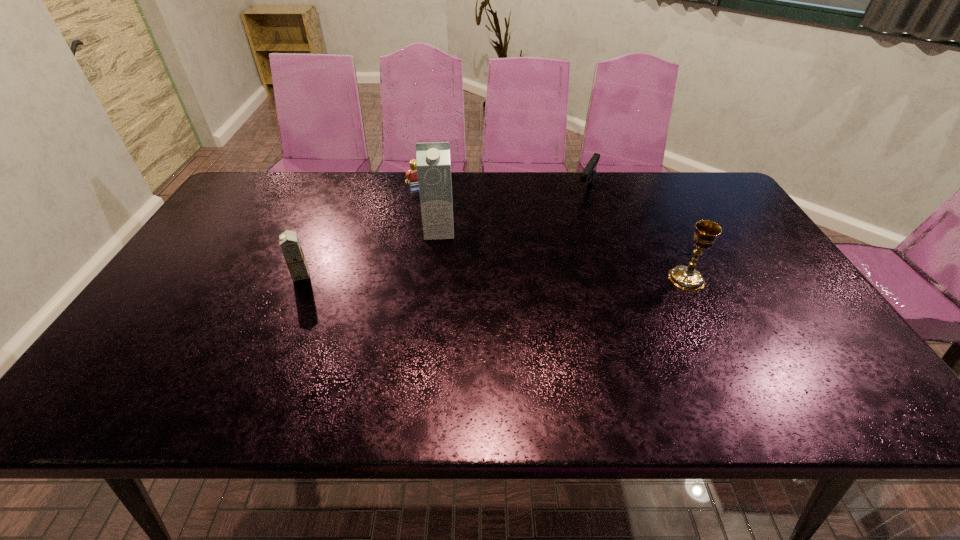
At what (x,y) coordinates should I click in order to perform the action: click on blank region between the rightmost object and the carton. Please return your answer as a coordinate pair (x, y). Looking at the image, I should click on (563, 255).

Find the location of `vacant point located between the leftmost object and the rightmost object`. vacant point located between the leftmost object and the rightmost object is located at coordinates (493, 277).

Find the location of `free area in between the rightmost object and the Lego`. free area in between the rightmost object and the Lego is located at coordinates (552, 234).

What are the coordinates of `vacant space that is in between the fourth object from left to right and the third object from right to left` in the screenshot? It's located at (513, 211).

Locate which object ranks third in proximity to the leftmost object. Please provide its 2D coordinates. Your answer should be formatted as a tuple, i.e. [(x, y)], where the tuple contains the x and y coordinates of a point satisfying the conditions above.

[(588, 174)]

I want to click on object identified as the closest to the pistol, so coord(687,278).

Find the location of a particular element. vacant point that satisfies the following two spatial constraints: 1. on the back side of the leftmost object; 2. on the left side of the third nearest object is located at coordinates (320, 231).

Locate an element on the screen. This screenshot has width=960, height=540. free space that satisfies the following two spatial constraints: 1. on the back side of the fourth object from left to right; 2. on the left side of the third nearest object is located at coordinates (444, 191).